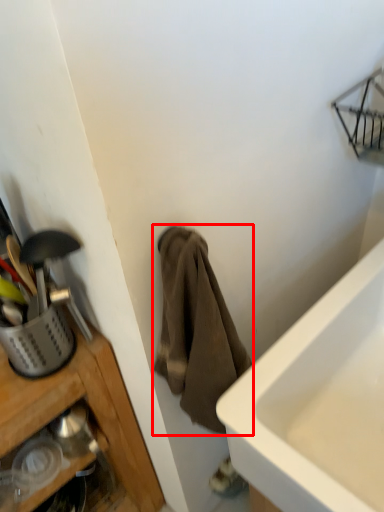
Question: From the image, what is the correct spatial relationship of towel/napkin (annotated by the red box) in relation to basket?

Choices:
 (A) left
 (B) right

Answer: (B)